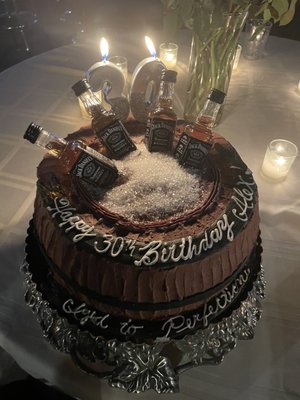
At what (x,y) coordinates should I click in order to perform the action: click on candles. Please return your answer as a coordinate pair (x, y). Image resolution: width=300 pixels, height=400 pixels. Looking at the image, I should click on (277, 162), (179, 49), (235, 60), (152, 55), (113, 64).